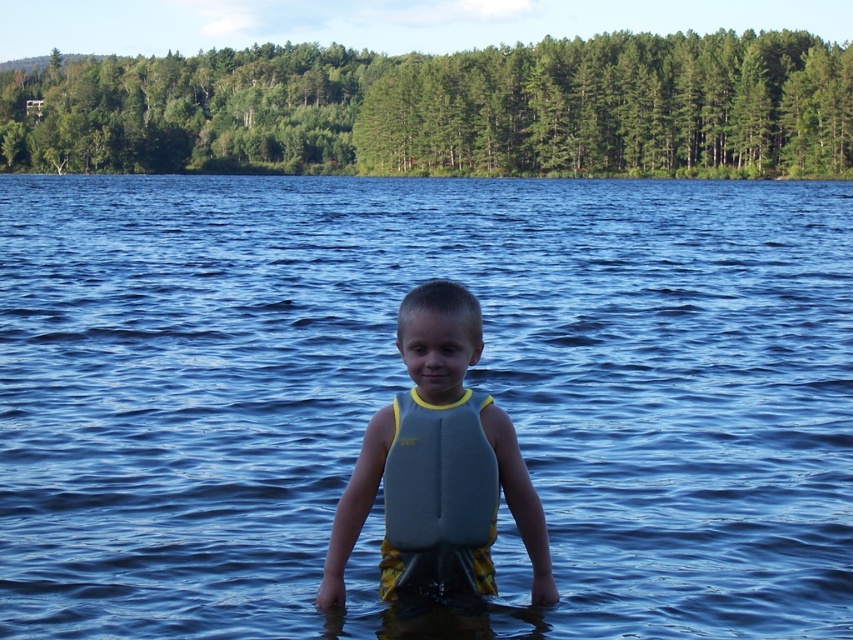
Can you confirm if blue water at center is positioned above gray/yellow fabric life vest at center?

Yes, blue water at center is above gray/yellow fabric life vest at center.

Can you confirm if blue water at center is smaller than gray/yellow fabric life vest at center?

Actually, blue water at center might be larger than gray/yellow fabric life vest at center.

Which is behind, point (201, 250) or point (331, 588)?

The point (201, 250) is more distant.

Locate an element on the screen. blue water at center is located at coordinates tap(409, 384).

Between point (453, 397) and point (401, 580), which one is positioned behind?

The point (401, 580) is more distant.

Does point (421, 572) come closer to viewer compared to point (392, 481)?

That is False.

From the picture: Measure the distance between gray/yellow fabric life vest at center and camera.

They are 4.57 meters apart.

Identify the location of gray/yellow fabric life vest at center. This screenshot has width=853, height=640. (438, 468).

Is blue water at center taller than gray matte life jacket at center?

Yes, blue water at center is taller than gray matte life jacket at center.

Find the location of a particular element. blue water at center is located at coordinates (409, 384).

At what (x,y) coordinates should I click in order to perform the action: click on blue water at center. Please return your answer as a coordinate pair (x, y). Looking at the image, I should click on (409, 384).